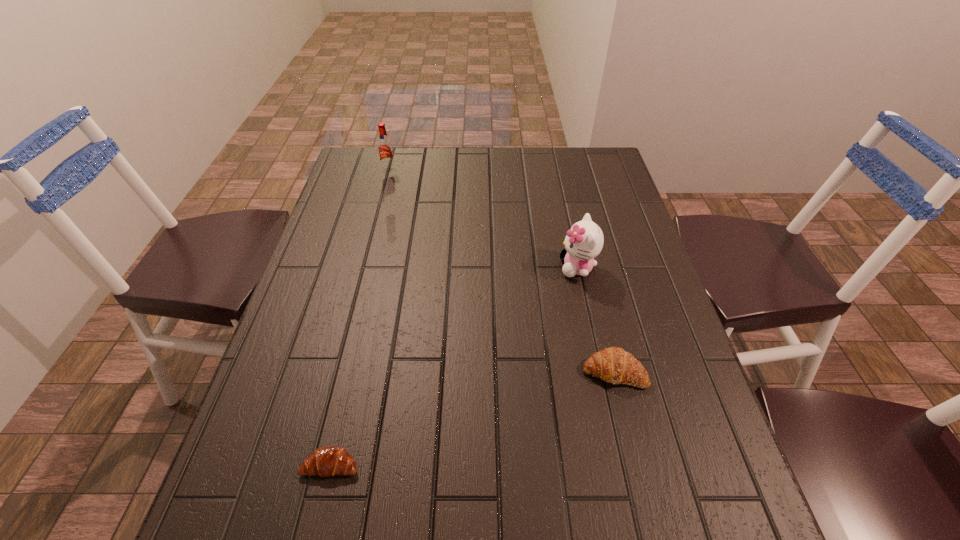
Identify the location of blank space located 0.120m on the left of the right crescent roll. (526, 372).

The width and height of the screenshot is (960, 540). What are the coordinates of `vacant space located on the front of the left crescent roll` in the screenshot? It's located at (314, 536).

This screenshot has width=960, height=540. I want to click on object present at the far edge, so click(x=385, y=149).

The width and height of the screenshot is (960, 540). What are the coordinates of `root beer located at the left edge` in the screenshot? It's located at (385, 149).

Locate an element on the screen. crescent roll located in the left edge section of the desktop is located at coordinates (326, 461).

Where is `kitten that is at the right edge`? kitten that is at the right edge is located at coordinates tap(584, 241).

Where is `crescent roll that is at the right edge`? The width and height of the screenshot is (960, 540). crescent roll that is at the right edge is located at coordinates (x=613, y=365).

What are the coordinates of `object present at the far left corner` in the screenshot? It's located at (385, 149).

Locate an element on the screen. The height and width of the screenshot is (540, 960). free space at the far edge is located at coordinates 443,166.

Identify the location of vacant position at the left edge of the desktop. The image size is (960, 540). (340, 228).